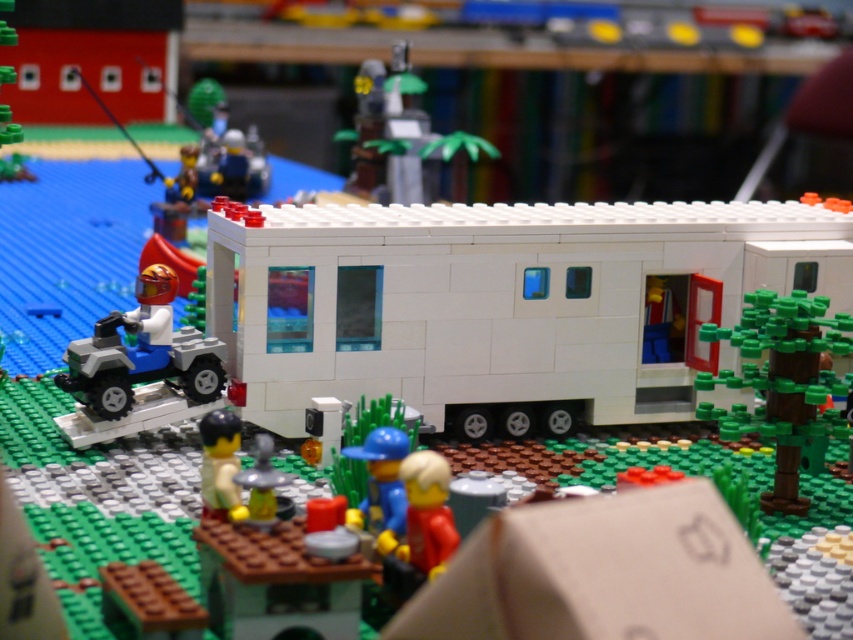
You are a Lego figure trying to reach the smooth red figure at center from the white plastic tree at upper center. The maximum distance you can jump is 5 feet. Can you reach them in one jump?

The distance between the white plastic tree at upper center and the smooth red figure at center is 5.05 feet, which is slightly more than your maximum jump of 5 feet. Therefore, you cannot reach them in one jump.